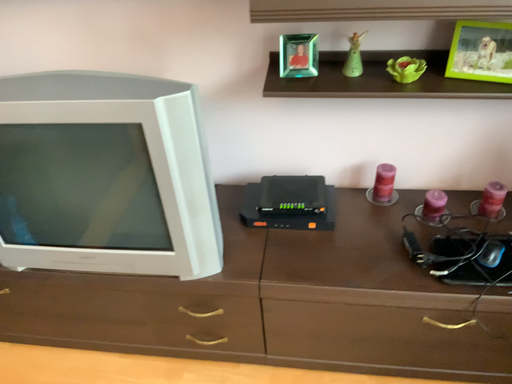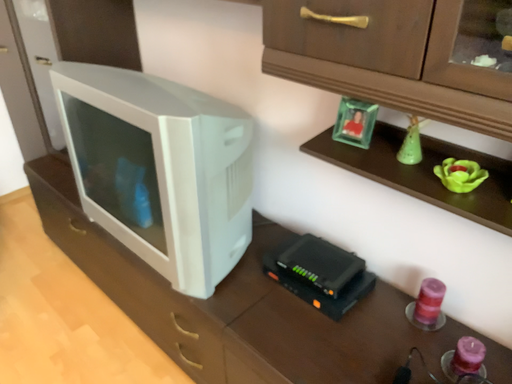
Question: How did the camera likely rotate when shooting the video?

Choices:
 (A) rotated upward
 (B) rotated downward

Answer: (A)